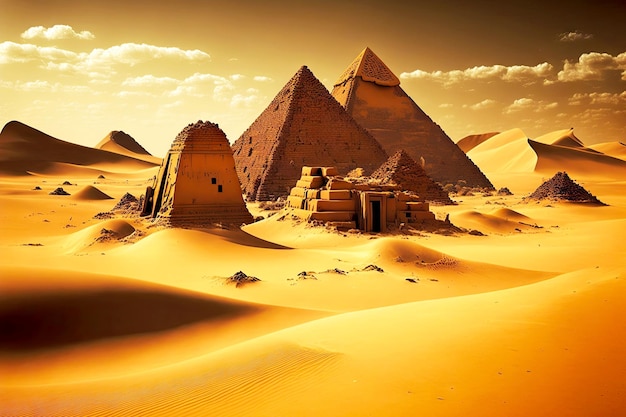
You are a GUI agent. You are given a task and a screenshot of the screen. Output one action in this format:
    pyautogui.click(x=<x>, y=<y>)
    Task: Click on the doorway
    
    Given the screenshot: What is the action you would take?
    pyautogui.click(x=377, y=208)